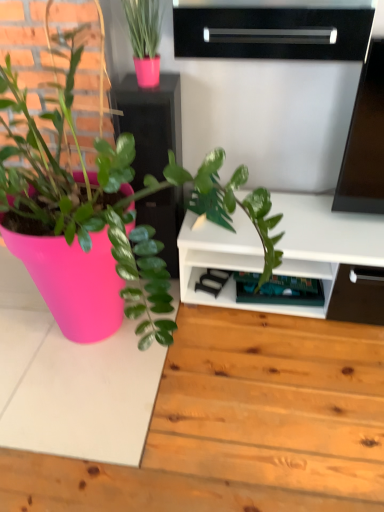
Question: Should I look upward or downward to see matte black cabinet at upper center?

Choices:
 (A) down
 (B) up

Answer: (B)

Question: From a real-world perspective, does green plastic shelf at lower center, the 2th shelf from the top, stand above matte black cabinet at upper center?

Choices:
 (A) yes
 (B) no

Answer: (B)

Question: Does green plastic shelf at lower center, positioned as the 1th shelf in bottom-to-top order, have a larger size compared to matte black cabinet at upper center?

Choices:
 (A) yes
 (B) no

Answer: (B)

Question: Does green plastic shelf at lower center, which ranks as the 2th shelf in front-to-back order, turn towards matte black cabinet at upper center?

Choices:
 (A) yes
 (B) no

Answer: (B)

Question: Is there a large distance between green plastic shelf at lower center, positioned as the 1th shelf in bottom-to-top order, and matte black cabinet at upper center?

Choices:
 (A) yes
 (B) no

Answer: (B)

Question: Is green plastic shelf at lower center, positioned as the 1th shelf in bottom-to-top order, next to matte black cabinet at upper center?

Choices:
 (A) yes
 (B) no

Answer: (B)

Question: Is green plastic shelf at lower center, positioned as the 1th shelf in bottom-to-top order, closer to camera compared to matte black cabinet at upper center?

Choices:
 (A) yes
 (B) no

Answer: (B)

Question: Is the position of matte black cabinet at upper center more distant than that of green plastic shelf at lower center, positioned as the 1th shelf in bottom-to-top order?

Choices:
 (A) no
 (B) yes

Answer: (A)

Question: Is matte black cabinet at upper center smaller than green plastic shelf at lower center, the 2th shelf from the top?

Choices:
 (A) yes
 (B) no

Answer: (B)

Question: From the image's perspective, is matte black cabinet at upper center on green plastic shelf at lower center, the 2th shelf from the top?

Choices:
 (A) yes
 (B) no

Answer: (A)

Question: Is green plastic shelf at lower center, the 2th shelf from the top, surrounded by matte black cabinet at upper center?

Choices:
 (A) yes
 (B) no

Answer: (B)

Question: Does matte black cabinet at upper center have a lesser height compared to green plastic shelf at lower center, which ranks as the 2th shelf in front-to-back order?

Choices:
 (A) yes
 (B) no

Answer: (B)

Question: Is matte black cabinet at upper center aimed at green plastic shelf at lower center, which ranks as the 2th shelf in front-to-back order?

Choices:
 (A) no
 (B) yes

Answer: (A)

Question: From a real-world perspective, is matte black cabinet at upper center over black glossy shelf at upper center, which ranks as the first shelf in front-to-back order?

Choices:
 (A) yes
 (B) no

Answer: (B)